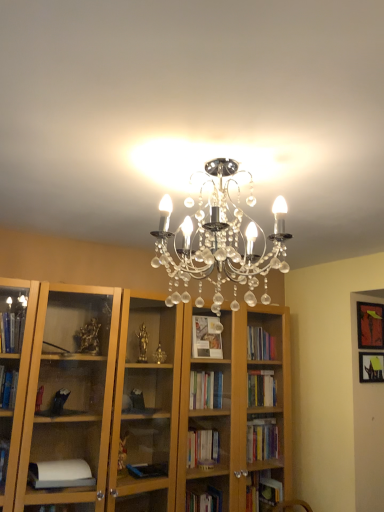
Question: From the image's perspective, is matte black picture frame at upper right, placed as the 2th picture frame when sorted from bottom to top, beneath matte black picture frame at upper right, the 2th picture frame from the top?

Choices:
 (A) no
 (B) yes

Answer: (A)

Question: Is the position of matte black picture frame at upper right, placed as the 2th picture frame when sorted from bottom to top, more distant than that of matte black picture frame at upper right, positioned as the 1th picture frame in bottom-to-top order?

Choices:
 (A) yes
 (B) no

Answer: (A)

Question: Is matte black picture frame at upper right, positioned as the 1th picture frame in bottom-to-top order, completely or partially inside matte black picture frame at upper right, placed as the 2th picture frame when sorted from bottom to top?

Choices:
 (A) no
 (B) yes

Answer: (A)

Question: Considering the relative sizes of matte black picture frame at upper right, placed as the first picture frame when sorted from top to bottom, and matte black picture frame at upper right, positioned as the 1th picture frame in bottom-to-top order, in the image provided, is matte black picture frame at upper right, placed as the first picture frame when sorted from top to bottom, shorter than matte black picture frame at upper right, positioned as the 1th picture frame in bottom-to-top order,?

Choices:
 (A) yes
 (B) no

Answer: (B)

Question: Are matte black picture frame at upper right, placed as the 2th picture frame when sorted from bottom to top, and matte black picture frame at upper right, the 2th picture frame from the top, making contact?

Choices:
 (A) no
 (B) yes

Answer: (A)

Question: Can you confirm if matte black picture frame at upper right, placed as the first picture frame when sorted from top to bottom, is positioned to the right of matte black picture frame at upper right, the 2th picture frame from the top?

Choices:
 (A) no
 (B) yes

Answer: (B)

Question: Is matte black picture frame at upper right, positioned as the 1th picture frame in bottom-to-top order, positioned behind matte black picture frame at upper right, placed as the 2th picture frame when sorted from bottom to top?

Choices:
 (A) yes
 (B) no

Answer: (B)

Question: Is matte black picture frame at upper right, positioned as the 1th picture frame in bottom-to-top order, to the right of matte black picture frame at upper right, placed as the first picture frame when sorted from top to bottom, from the viewer's perspective?

Choices:
 (A) yes
 (B) no

Answer: (B)

Question: Could you tell me if matte black picture frame at upper right, the 2th picture frame from the top, is facing matte black picture frame at upper right, placed as the first picture frame when sorted from top to bottom?

Choices:
 (A) no
 (B) yes

Answer: (A)

Question: Is matte black picture frame at upper right, the 2th picture frame from the top, surrounding matte black picture frame at upper right, placed as the first picture frame when sorted from top to bottom?

Choices:
 (A) no
 (B) yes

Answer: (A)

Question: Is matte black picture frame at upper right, the 2th picture frame from the top, looking in the opposite direction of matte black picture frame at upper right, placed as the first picture frame when sorted from top to bottom?

Choices:
 (A) yes
 (B) no

Answer: (B)

Question: Is matte black picture frame at upper right, positioned as the 1th picture frame in bottom-to-top order, not near matte black picture frame at upper right, placed as the first picture frame when sorted from top to bottom?

Choices:
 (A) yes
 (B) no

Answer: (B)

Question: Is matte black picture frame at upper right, placed as the first picture frame when sorted from top to bottom, in front of or behind matte black picture frame at upper right, the 2th picture frame from the top, in the image?

Choices:
 (A) front
 (B) behind

Answer: (B)